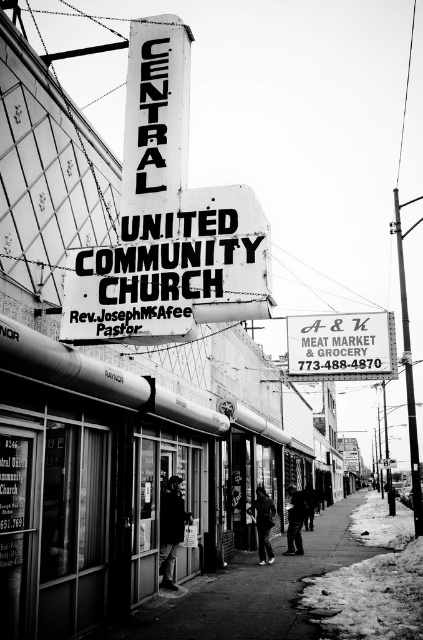
Who is positioned more to the right, smooth concrete sidewalk at center or dark gray jacket at center?

smooth concrete sidewalk at center

Does smooth concrete sidewalk at center appear on the left side of dark gray jacket at center?

In fact, smooth concrete sidewalk at center is to the right of dark gray jacket at center.

This screenshot has width=423, height=640. I want to click on smooth concrete sidewalk at center, so click(263, 584).

Who is more distant from viewer, (338,336) or (307,502)?

Positioned behind is point (307,502).

Does white plastic sign at center have a lesser width compared to dark clothing figure at center?

Incorrect, white plastic sign at center's width is not less than dark clothing figure at center's.

Does point (321, 344) come in front of point (315, 506)?

Yes, point (321, 344) is closer to viewer.

At what (x,y) coordinates should I click in order to perform the action: click on white plastic sign at center. Please return your answer as a coordinate pair (x, y). The image size is (423, 640). Looking at the image, I should click on (342, 346).

Who is lower down, dark fabric coat at center or dark gray jacket at center?

dark gray jacket at center

Can you confirm if dark fabric coat at center is positioned below dark gray jacket at center?

No, dark fabric coat at center is not below dark gray jacket at center.

Image resolution: width=423 pixels, height=640 pixels. In order to click on dark fabric coat at center in this screenshot , I will do `click(170, 529)`.